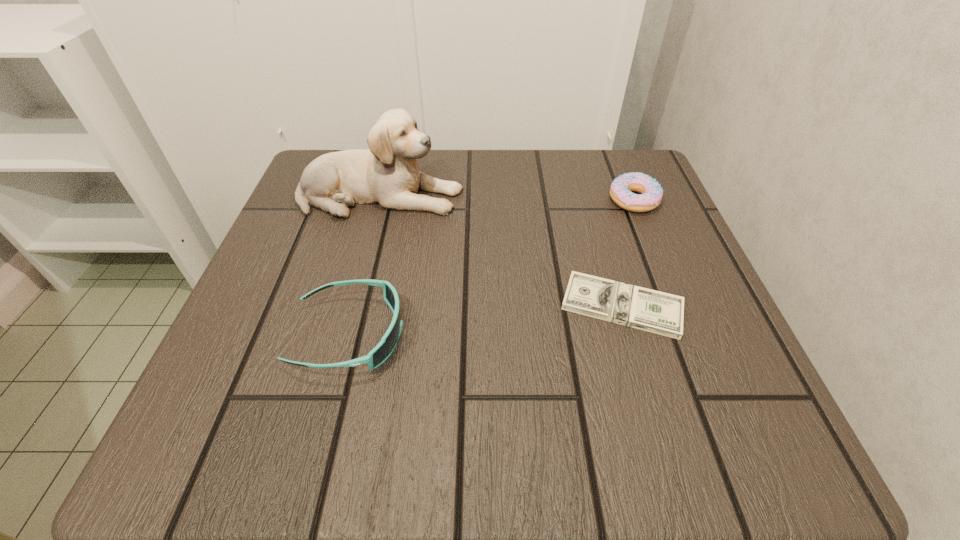
At what (x,y) coordinates should I click in order to perform the action: click on puppy that is at the left edge. Please return your answer as a coordinate pair (x, y). Image resolution: width=960 pixels, height=540 pixels. Looking at the image, I should click on (387, 173).

Where is `sunglasses present at the left edge`? The width and height of the screenshot is (960, 540). sunglasses present at the left edge is located at coordinates (378, 355).

Locate an element on the screen. This screenshot has width=960, height=540. doughnut that is at the right edge is located at coordinates (651, 192).

Identify the location of dollar situated at the right edge. (661, 313).

This screenshot has height=540, width=960. Find the location of `object located at the far left corner`. object located at the far left corner is located at coordinates (387, 173).

Identify the location of object located in the far right corner section of the desktop. (651, 192).

Locate an element on the screen. The width and height of the screenshot is (960, 540). blank space at the far edge is located at coordinates (463, 171).

Find the location of `blank space at the near edge of the desktop`. blank space at the near edge of the desktop is located at coordinates click(x=348, y=405).

Where is `free space at the left edge of the desktop`? This screenshot has width=960, height=540. free space at the left edge of the desktop is located at coordinates (324, 251).

Locate an element on the screen. The height and width of the screenshot is (540, 960). vacant space at the right edge of the desktop is located at coordinates (654, 383).